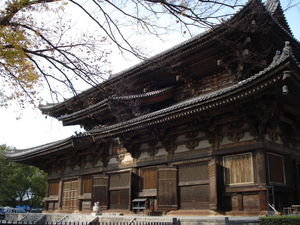
This screenshot has height=225, width=300. In order to click on tiles in this screenshot , I will do `click(204, 95)`.